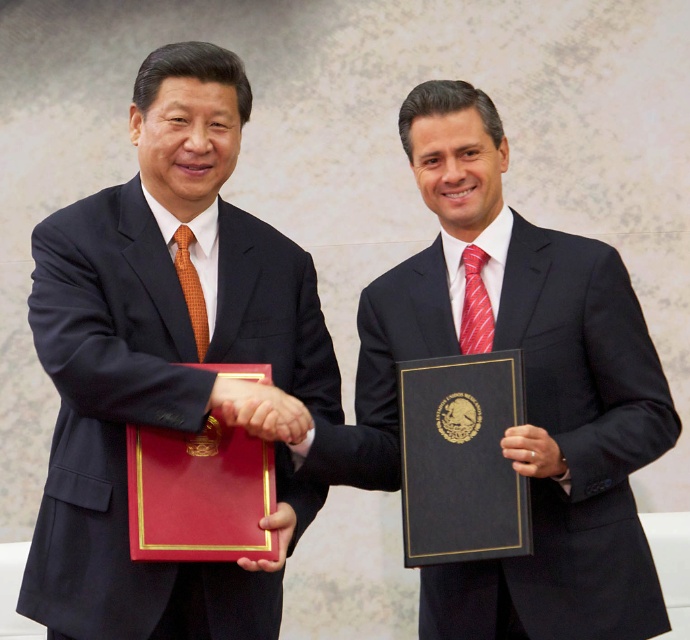
Question: Among these points, which one is farthest from the camera?

Choices:
 (A) (184, 248)
 (B) (471, 262)

Answer: (B)

Question: Can you confirm if red striped tie at center is positioned below matte red folder at center?

Choices:
 (A) yes
 (B) no

Answer: (B)

Question: Which object is farther from the camera taking this photo?

Choices:
 (A) matte black suit at center
 (B) red striped tie at center

Answer: (B)

Question: Is black satin suit at center bigger than matte black hand at center?

Choices:
 (A) no
 (B) yes

Answer: (B)

Question: Which point is farther to the camera?

Choices:
 (A) matte black hand at center
 (B) red striped tie at center

Answer: (B)

Question: Does black satin suit at center lie behind red striped tie at center?

Choices:
 (A) yes
 (B) no

Answer: (B)